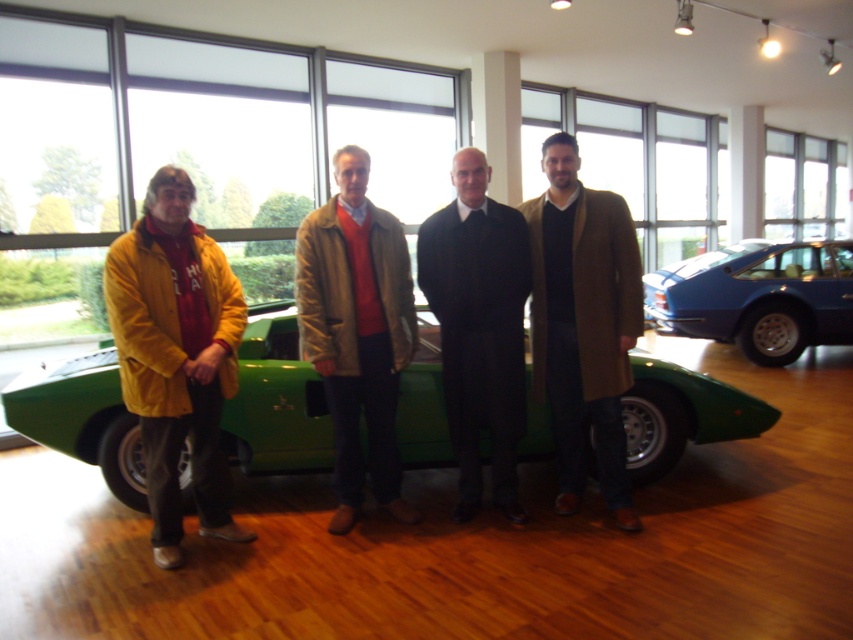
Question: Does brown wool coat at center lie behind blue metallic car at right?

Choices:
 (A) yes
 (B) no

Answer: (B)

Question: Considering the real-world distances, which object is farthest from the blue metallic car at right?

Choices:
 (A) matte brown coat at center
 (B) brown wool coat at center
 (C) yellow suede jacket at left

Answer: (C)

Question: Is yellow suede jacket at left behind black wool suit at center?

Choices:
 (A) yes
 (B) no

Answer: (B)

Question: Does yellow suede jacket at left have a lesser width compared to black wool suit at center?

Choices:
 (A) no
 (B) yes

Answer: (A)

Question: Which of these objects is positioned closest to the yellow suede jacket at left?

Choices:
 (A) black wool suit at center
 (B) blue metallic car at right

Answer: (A)

Question: Which of the following is the farthest from the observer?

Choices:
 (A) (115, 429)
 (B) (316, 365)
 (C) (787, 269)
 (D) (463, 371)

Answer: (C)